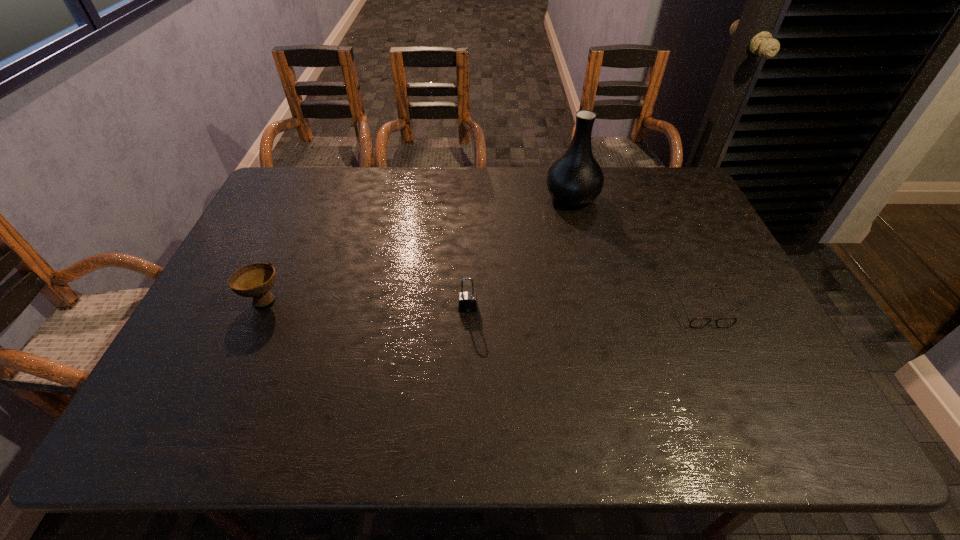
Find the location of a particular element. vacant space that is in between the third object from right to left and the farthest object is located at coordinates (520, 252).

Image resolution: width=960 pixels, height=540 pixels. I want to click on vacant area that lies between the padlock and the shortest object, so click(x=584, y=308).

The image size is (960, 540). Identify the location of free space between the padlock and the soup bowl. (366, 303).

Image resolution: width=960 pixels, height=540 pixels. I want to click on unoccupied position between the third object from right to left and the leftmost object, so [366, 303].

In order to click on vacant space that's between the soup bowl and the padlock in this screenshot , I will do (x=366, y=303).

I want to click on free space between the shortest object and the third tallest object, so click(x=482, y=303).

You are a GUI agent. You are given a task and a screenshot of the screen. Output one action in this format:
    pyautogui.click(x=<x>, y=<y>)
    Task: Click on the free point between the soup bowl and the rightmost object
    The width and height of the screenshot is (960, 540).
    Given the screenshot: What is the action you would take?
    pyautogui.click(x=482, y=303)

Identify the location of unoccupied area between the leftmost object and the shortest object. The image size is (960, 540). (482, 303).

Find the location of a particular element. Image resolution: width=960 pixels, height=540 pixels. vacant area that lies between the soup bowl and the vase is located at coordinates (418, 248).

In order to click on free space between the farthest object and the second object from left to right in this screenshot , I will do `click(520, 252)`.